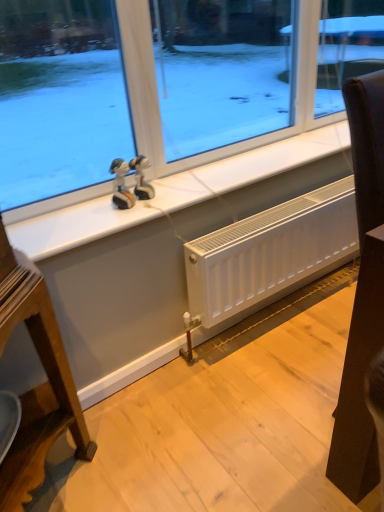
Question: Is glossy plastic figurine at upper center, marked as the second figurine in a left-to-right arrangement, looking in the opposite direction of white matte radiator at lower center?

Choices:
 (A) yes
 (B) no

Answer: (B)

Question: Does glossy plastic figurine at upper center, which is counted as the first figurine, starting from the right, have a greater width compared to white matte radiator at lower center?

Choices:
 (A) yes
 (B) no

Answer: (B)

Question: From the image's perspective, does glossy plastic figurine at upper center, marked as the second figurine in a left-to-right arrangement, appear lower than white matte radiator at lower center?

Choices:
 (A) no
 (B) yes

Answer: (A)

Question: Is glossy plastic figurine at upper center, marked as the second figurine in a left-to-right arrangement, not close to white matte radiator at lower center?

Choices:
 (A) yes
 (B) no

Answer: (B)

Question: Can you confirm if glossy plastic figurine at upper center, marked as the second figurine in a left-to-right arrangement, is positioned to the left of white matte radiator at lower center?

Choices:
 (A) yes
 (B) no

Answer: (A)

Question: Considering the positions of white tile at upper center and matte plastic figurine at center, the second figurine from the right, in the image, is white tile at upper center taller or shorter than matte plastic figurine at center, the second figurine from the right,?

Choices:
 (A) short
 (B) tall

Answer: (A)

Question: Is point (74, 246) positioned closer to the camera than point (127, 207)?

Choices:
 (A) farther
 (B) closer

Answer: (B)

Question: From a real-world perspective, is white tile at upper center physically located above or below matte plastic figurine at center, which ranks as the 1th figurine in left-to-right order?

Choices:
 (A) above
 (B) below

Answer: (B)

Question: In the image, is white tile at upper center on the left side or the right side of matte plastic figurine at center, which ranks as the 1th figurine in left-to-right order?

Choices:
 (A) left
 (B) right

Answer: (B)

Question: Considering the positions of black leather chair at right and matte plastic figurine at center, which ranks as the 1th figurine in left-to-right order, in the image, is black leather chair at right wider or thinner than matte plastic figurine at center, which ranks as the 1th figurine in left-to-right order,?

Choices:
 (A) wide
 (B) thin

Answer: (A)

Question: Is black leather chair at right taller or shorter than matte plastic figurine at center, the second figurine from the right?

Choices:
 (A) tall
 (B) short

Answer: (A)

Question: Is black leather chair at right spatially inside matte plastic figurine at center, which ranks as the 1th figurine in left-to-right order, or outside of it?

Choices:
 (A) inside
 (B) outside

Answer: (B)

Question: Does point (370, 204) appear closer or farther from the camera than point (119, 188)?

Choices:
 (A) closer
 (B) farther

Answer: (A)

Question: Based on their sizes in the image, would you say glossy plastic figurine at upper center, marked as the second figurine in a left-to-right arrangement, is bigger or smaller than white tile at upper center?

Choices:
 (A) small
 (B) big

Answer: (A)

Question: From a real-world perspective, is glossy plastic figurine at upper center, which is counted as the first figurine, starting from the right, physically located above or below white tile at upper center?

Choices:
 (A) above
 (B) below

Answer: (A)